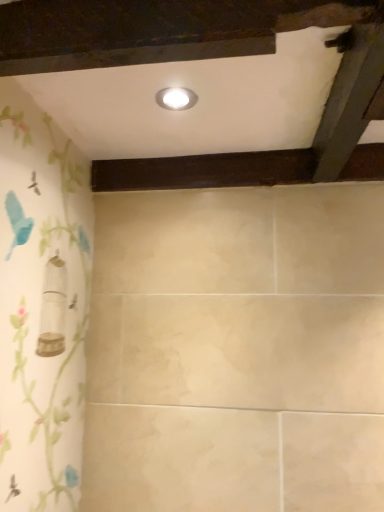
Question: Could you tell me if white glossy light fixture at upper center is facing dark wood plank at center?

Choices:
 (A) no
 (B) yes

Answer: (A)

Question: From the image's perspective, is white glossy light fixture at upper center over dark wood plank at center?

Choices:
 (A) yes
 (B) no

Answer: (A)

Question: Is white glossy light fixture at upper center positioned far away from dark wood plank at center?

Choices:
 (A) yes
 (B) no

Answer: (B)

Question: Can you confirm if white glossy light fixture at upper center is bigger than dark wood plank at center?

Choices:
 (A) no
 (B) yes

Answer: (A)

Question: Is white glossy light fixture at upper center in contact with dark wood plank at center?

Choices:
 (A) no
 (B) yes

Answer: (A)

Question: Is white glossy light fixture at upper center outside of dark wood plank at center?

Choices:
 (A) no
 (B) yes

Answer: (B)

Question: Is the depth of dark wood plank at center less than that of white glossy light fixture at upper center?

Choices:
 (A) yes
 (B) no

Answer: (B)

Question: Is dark wood plank at center placed right next to white glossy light fixture at upper center?

Choices:
 (A) yes
 (B) no

Answer: (B)

Question: From a real-world perspective, is dark wood plank at center positioned over white glossy light fixture at upper center based on gravity?

Choices:
 (A) no
 (B) yes

Answer: (A)

Question: From the image's perspective, does dark wood plank at center appear lower than white glossy light fixture at upper center?

Choices:
 (A) no
 (B) yes

Answer: (B)

Question: Is dark wood plank at center at the right side of white glossy light fixture at upper center?

Choices:
 (A) yes
 (B) no

Answer: (A)

Question: From the image's perspective, would you say dark wood plank at center is positioned over white glossy light fixture at upper center?

Choices:
 (A) no
 (B) yes

Answer: (A)

Question: Considering the positions of dark wood plank at center and white glossy light fixture at upper center in the image, is dark wood plank at center bigger or smaller than white glossy light fixture at upper center?

Choices:
 (A) small
 (B) big

Answer: (B)